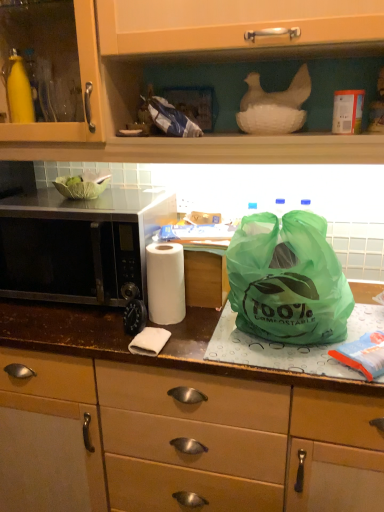
The image size is (384, 512). I want to click on free spot to the left of white matte paper towel at center, so pyautogui.click(x=88, y=335).